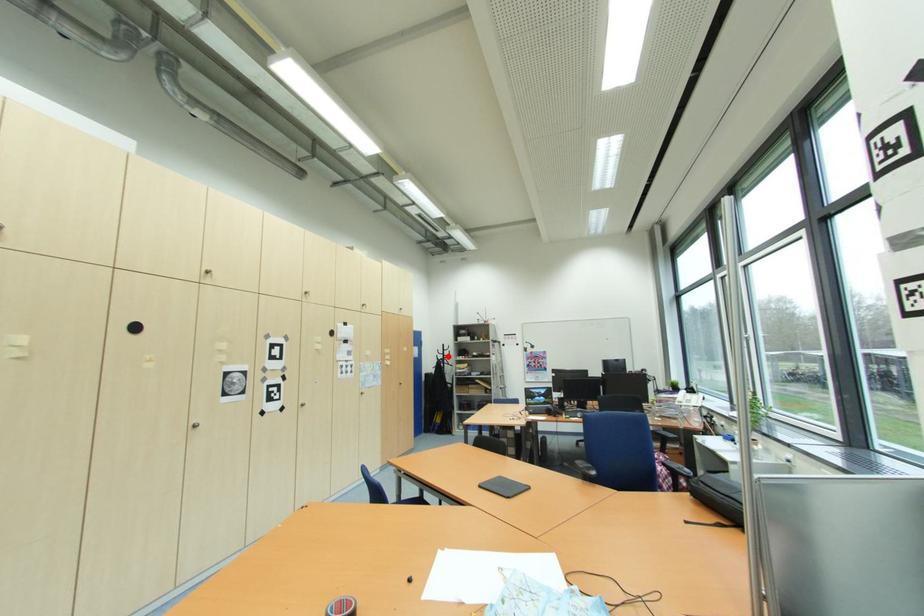
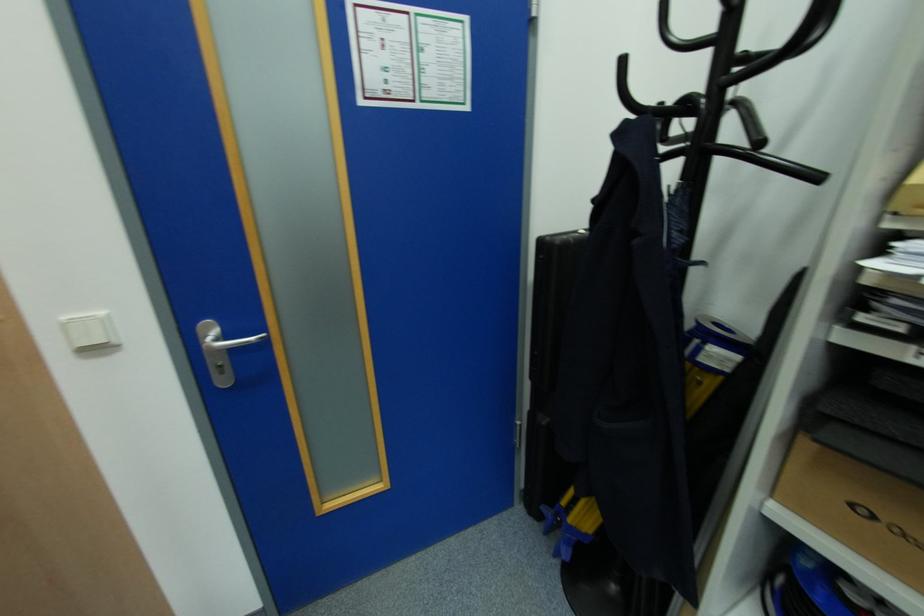
Find the pixel in the second image that matches the highlighted location in the first image.

(726, 61)